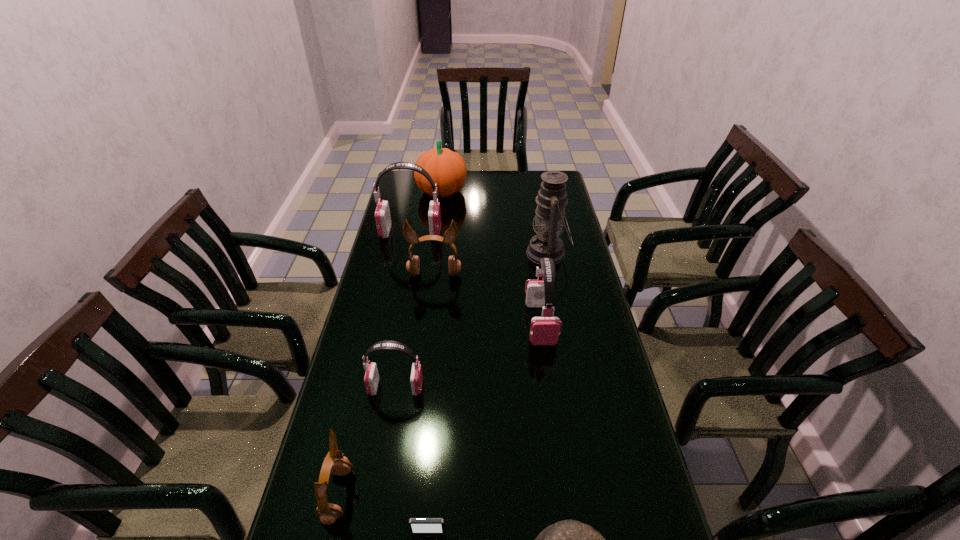
The image size is (960, 540). Identify the location of the closest object to the iPod. (328, 513).

Image resolution: width=960 pixels, height=540 pixels. In order to click on the third closest object to the third farthest earphone in this screenshot , I will do `click(371, 379)`.

You are a GUI agent. You are given a task and a screenshot of the screen. Output one action in this format:
    pyautogui.click(x=<x>, y=<y>)
    Task: Click on the earphone that stands as the third closest to the smaller brown earphone
    The width and height of the screenshot is (960, 540).
    Given the screenshot: What is the action you would take?
    pyautogui.click(x=413, y=264)

Identify which earphone is the closest to the nearest earphone. Please provide its 2D coordinates. Your answer should be formatted as a tuple, i.e. [(x, y)], where the tuple contains the x and y coordinates of a point satisfying the conditions above.

[(371, 379)]

Locate which pink earphone is the second closest to the second biggest pink earphone. Please provide its 2D coordinates. Your answer should be formatted as a tuple, i.e. [(x, y)], where the tuple contains the x and y coordinates of a point satisfying the conditions above.

[(382, 214)]

Locate which pink earphone is the closest to the farthest pink earphone. Please provide its 2D coordinates. Your answer should be formatted as a tuple, i.e. [(x, y)], where the tuple contains the x and y coordinates of a point satisfying the conditions above.

[(545, 330)]

At what (x,y) coordinates should I click in order to perform the action: click on vacant space that satisfies the following two spatial constraints: 1. on the outer surface of the third nearest earphone; 2. on the front-facing side of the left brown earphone. Please return your answer as a coordinate pair (x, y). Looking at the image, I should click on (564, 495).

Identify the location of vacant point that satisfies the following two spatial constraints: 1. on the outer surface of the farthest earphone; 2. on the right side of the oil lamp. (406, 254).

Locate an element on the screen. This screenshot has height=540, width=960. free spot that satisfies the following two spatial constraints: 1. on the front-facing side of the right brown earphone; 2. on the front-facing side of the smaller brown earphone is located at coordinates (408, 495).

Find the location of `vacant space that satisfies the following two spatial constraints: 1. on the front-facing side of the farther brown earphone; 2. on the front-facing side of the nearest earphone`. vacant space that satisfies the following two spatial constraints: 1. on the front-facing side of the farther brown earphone; 2. on the front-facing side of the nearest earphone is located at coordinates (408, 495).